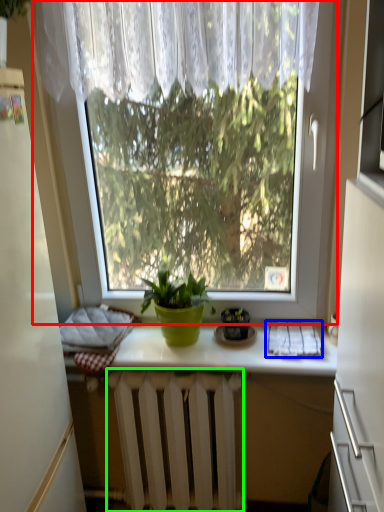
Question: Considering the real-world distances, which object is closest to window (highlighted by a red box)? cloth (highlighted by a blue box) or radiator (highlighted by a green box).

Choices:
 (A) cloth
 (B) radiator

Answer: (A)